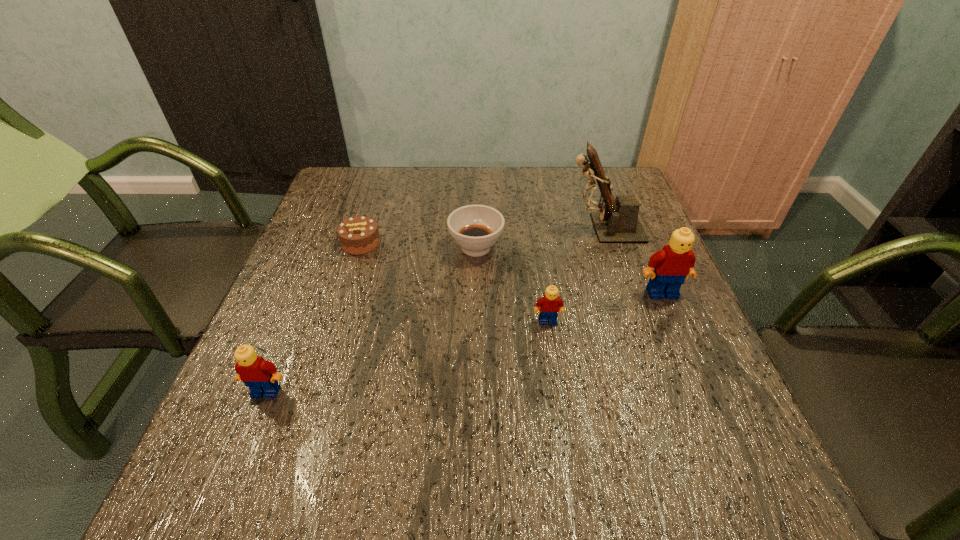
Where is `Lego that is the closest to the third tallest object`? The height and width of the screenshot is (540, 960). Lego that is the closest to the third tallest object is located at coordinates (550, 304).

Find the location of a particular element. This screenshot has height=540, width=960. Lego that is the third closest to the figurine is located at coordinates (261, 376).

What are the coordinates of `free space that satisfies the following two spatial constraints: 1. on the front-facing side of the tallest object; 2. on the front-facing side of the fifth farthest object` in the screenshot? It's located at (635, 321).

Identify the location of vacant position in the image that satisfies the following two spatial constraints: 1. on the front-facing side of the tallest object; 2. on the front side of the third object from left to right. (610, 247).